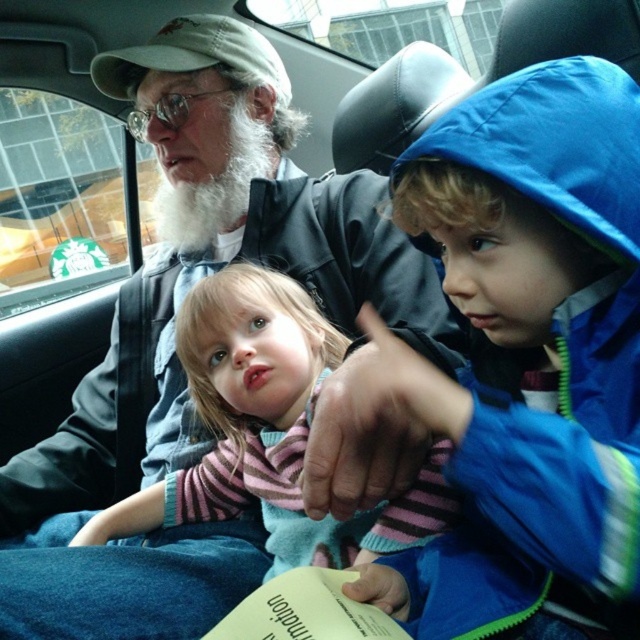
You are a photographer trying to capture the boy pointing towards something outside the car. The boy is pointing at a specific location marked by point (228,40). If your camera has a maximum focus range of 5 feet, will it be able to focus on the point where the boy is pointing?

The point (228,40) is 4.71 feet away from the camera, so yes, the camera can focus on it since it is within the 5 feet range.